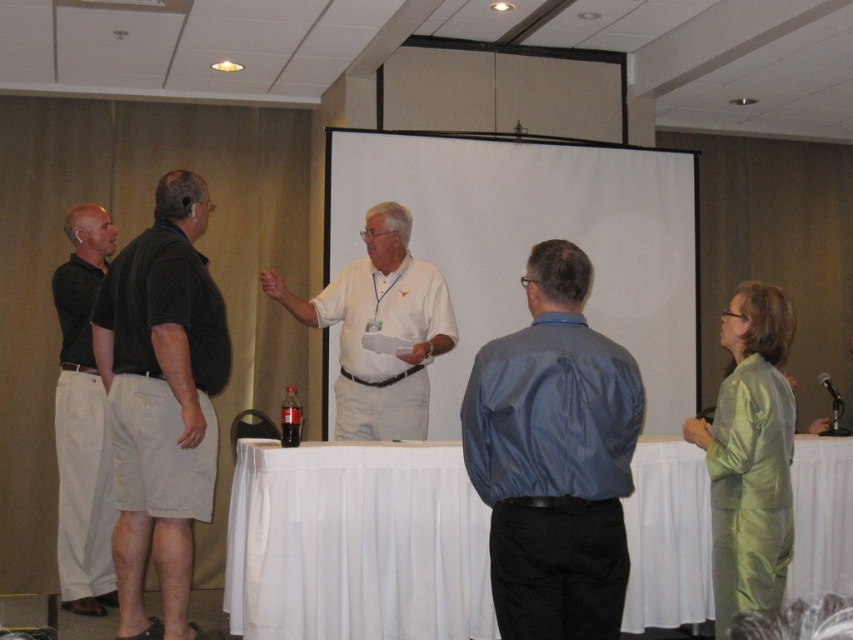
Who is more forward, (561, 596) or (399, 371)?

Point (561, 596)

Can you confirm if blue satin shirt at center is positioned to the right of white matte shirt at center?

Indeed, blue satin shirt at center is positioned on the right side of white matte shirt at center.

Who is more distant from viewer, (x=630, y=381) or (x=437, y=305)?

The point (x=437, y=305) is more distant.

You are a GUI agent. You are given a task and a screenshot of the screen. Output one action in this format:
    pyautogui.click(x=<x>, y=<y>)
    Task: Click on the blue satin shirt at center
    Image resolution: width=853 pixels, height=640 pixels.
    Given the screenshot: What is the action you would take?
    pyautogui.click(x=554, y=458)

Does white matte projection screen at center have a larger size compared to white matte shirt at center?

Correct, white matte projection screen at center is larger in size than white matte shirt at center.

Between point (595, 304) and point (433, 320), which one is positioned behind?

The point (595, 304) is behind.

Which is in front, point (657, 396) or point (413, 372)?

Point (413, 372)

This screenshot has height=640, width=853. What are the coordinates of `white matte projection screen at center` in the screenshot? It's located at (534, 243).

Does blue satin shirt at center have a larger size compared to green satin dress at right?

No, blue satin shirt at center is not bigger than green satin dress at right.

Between blue satin shirt at center and green satin dress at right, which one has less height?

blue satin shirt at center is shorter.

Measure the distance between point (541, 394) and camera.

They are 2.45 meters apart.

Find the location of a particular element. This screenshot has height=640, width=853. blue satin shirt at center is located at coordinates (554, 458).